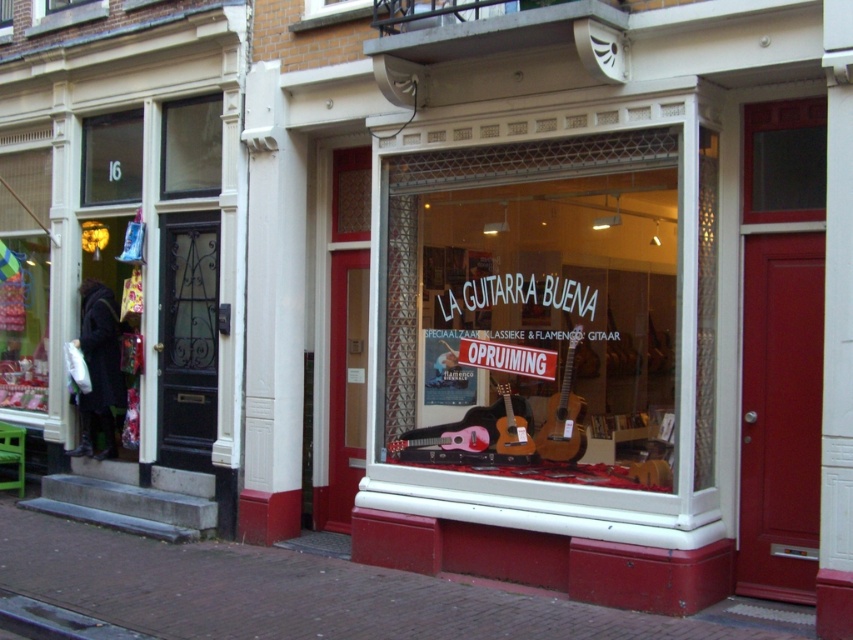
You are a delivery person who needs to place a large package in the music shop. The package is taller than the clear glass window at upper left. Can you fit it behind the clear glass guitars at center?

The clear glass guitars at center is much taller than the clear glass window at upper left, so the package taller than the clear glass window at upper left can fit behind the clear glass guitars at center.

You are a customer looking at the display window of La Guitarra Buena. You notice two clear glass items in the window. One is labeled as clear glass guitars at center and the other as clear glass window at upper left. Which of these items is closer to you from your viewing position outside the store?

The clear glass guitars at center is closer to you because it is in front of the clear glass window at upper left, making it the nearer object when viewed from outside the store.